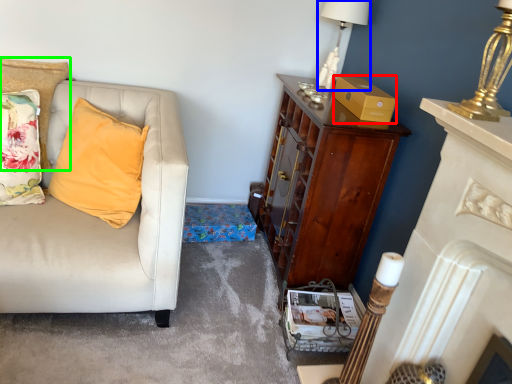
Question: Which is farther away from box (highlighted by a red box)? lamp (highlighted by a blue box) or cushion (highlighted by a green box)?

Choices:
 (A) lamp
 (B) cushion

Answer: (B)